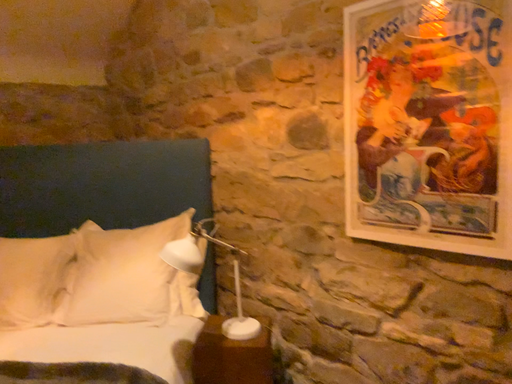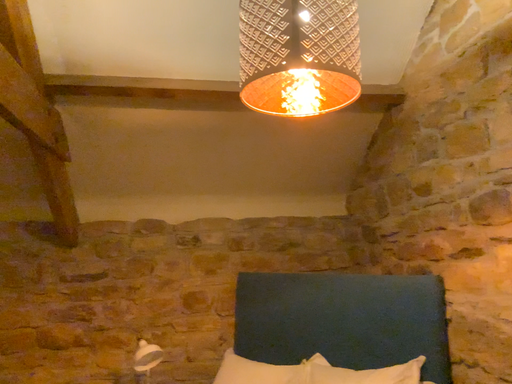
Question: How did the camera likely rotate when shooting the video?

Choices:
 (A) rotated upward
 (B) rotated downward

Answer: (A)